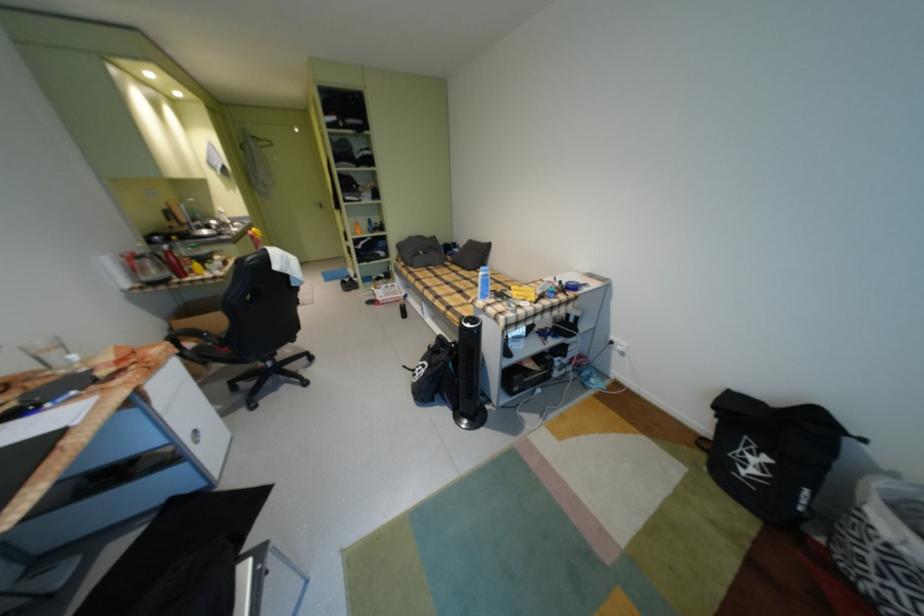
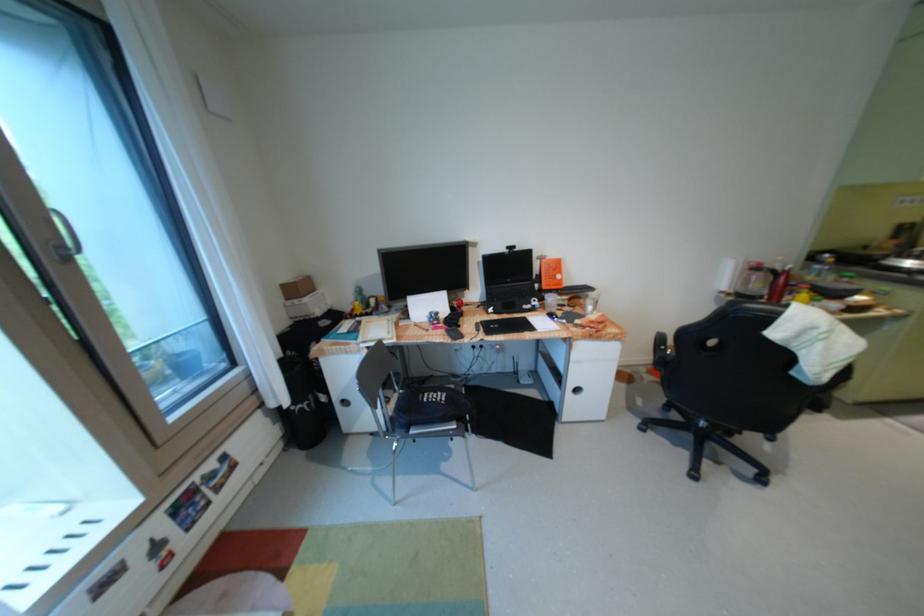
In the second image, find the point that corresponds to pixel 185 277 in the first image.

(776, 299)